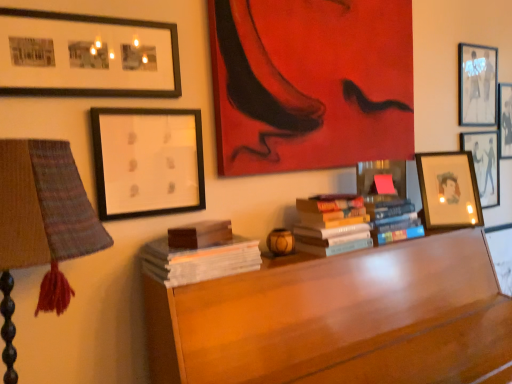
Measure the distance between point (x=343, y=65) and camera.

The distance of point (x=343, y=65) from camera is 5.27 feet.

Find the location of a particular element. matte brown book at center, acting as the third book starting from the right is located at coordinates [x=200, y=234].

This screenshot has height=384, width=512. In order to click on matte black picture frame at upper right, which appears as the fifth picture frame when viewed from the left in this screenshot , I will do `click(478, 85)`.

What do you see at coordinates (199, 254) in the screenshot?
I see `white paper book at left, which is the 4th book in right-to-left order` at bounding box center [199, 254].

What is the approximate width of matte wooden picture frame at right, which is the 4th picture frame from right to left?

11.02 inches.

Image resolution: width=512 pixels, height=384 pixels. I want to click on matte black framed photos at upper left, marked as the seventh picture frame in a right-to-left arrangement, so click(x=86, y=56).

Locate an element on the screen. The height and width of the screenshot is (384, 512). matte red painting at upper center, which is the 5th picture frame from right to left is located at coordinates (311, 83).

Does hardcover books at center, the second book in the right-to-left sequence, contain hardcover books at center, arranged as the fourth book when viewed from the left?

No, hardcover books at center, arranged as the fourth book when viewed from the left, is not inside hardcover books at center, the second book in the right-to-left sequence.

Is hardcover books at center, marked as the 3th book in a left-to-right arrangement, in contact with hardcover books at center, acting as the 1th book starting from the right?

No, hardcover books at center, marked as the 3th book in a left-to-right arrangement, is not in contact with hardcover books at center, acting as the 1th book starting from the right.

Find the location of `book behind the hardcover books at center, the second book in the right-to-left sequence`. book behind the hardcover books at center, the second book in the right-to-left sequence is located at coordinates (392, 219).

Looking at this image, considering the positions of objects hardcover books at center, the second book in the right-to-left sequence, and hardcover books at center, arranged as the fourth book when viewed from the left, in the image provided, who is more to the left, hardcover books at center, the second book in the right-to-left sequence, or hardcover books at center, arranged as the fourth book when viewed from the left,?

hardcover books at center, the second book in the right-to-left sequence, is more to the left.

Between matte wooden picture frame at right, the 4th picture frame when ordered from left to right, and wooden desk at center, which one has smaller width?

Thinner between the two is matte wooden picture frame at right, the 4th picture frame when ordered from left to right.

Is matte wooden picture frame at right, the 4th picture frame when ordered from left to right, bigger than wooden desk at center?

Actually, matte wooden picture frame at right, the 4th picture frame when ordered from left to right, might be smaller than wooden desk at center.

Which is correct: matte wooden picture frame at right, which is the 4th picture frame from right to left, is inside wooden desk at center, or outside of it?

matte wooden picture frame at right, which is the 4th picture frame from right to left, is outside wooden desk at center.

Considering the relative positions of hardcover books at center, marked as the 3th book in a left-to-right arrangement, and wooden desk at center in the image provided, is hardcover books at center, marked as the 3th book in a left-to-right arrangement, to the left or to the right of wooden desk at center?

From the image, it's evident that hardcover books at center, marked as the 3th book in a left-to-right arrangement, is to the left of wooden desk at center.

Is hardcover books at center, marked as the 3th book in a left-to-right arrangement, positioned in front of wooden desk at center?

No, hardcover books at center, marked as the 3th book in a left-to-right arrangement, is behind wooden desk at center.

Can you tell me how much hardcover books at center, the second book in the right-to-left sequence, and wooden desk at center differ in facing direction?

hardcover books at center, the second book in the right-to-left sequence, and wooden desk at center are facing 4 degrees away from each other.

The width and height of the screenshot is (512, 384). In the image, there is a hardcover books at center, the second book in the right-to-left sequence. Identify the location of furniture below it (from the image's perspective). (338, 319).

Does matte black picture frame at upper right, the third picture frame from the right, have a smaller size compared to white paper book at left, which is the 4th book in right-to-left order?

Incorrect, matte black picture frame at upper right, the third picture frame from the right, is not smaller in size than white paper book at left, which is the 4th book in right-to-left order.

Which point is more distant from viewer, (480, 115) or (197, 231)?

The point (480, 115) is behind.

Is matte black picture frame at upper right, which appears as the fifth picture frame when viewed from the left, spatially inside white paper book at left, which is the 4th book in right-to-left order, or outside of it?

matte black picture frame at upper right, which appears as the fifth picture frame when viewed from the left, is spatially situated outside white paper book at left, which is the 4th book in right-to-left order.

Is point (497, 55) positioned after point (360, 244)?

Yes.

Could hardcover books at center, marked as the 3th book in a left-to-right arrangement, be considered to be inside matte black picture frame at upper right, the third picture frame from the right?

No, hardcover books at center, marked as the 3th book in a left-to-right arrangement, is located outside of matte black picture frame at upper right, the third picture frame from the right.

From a real-world perspective, is matte black picture frame at upper right, the third picture frame from the right, above or below hardcover books at center, the second book in the right-to-left sequence?

From a real-world perspective, matte black picture frame at upper right, the third picture frame from the right, is physically above hardcover books at center, the second book in the right-to-left sequence.

Is matte black picture frame at upper right, which appears as the fifth picture frame when viewed from the left, facing towards hardcover books at center, the second book in the right-to-left sequence?

No, matte black picture frame at upper right, which appears as the fifth picture frame when viewed from the left, is not turned towards hardcover books at center, the second book in the right-to-left sequence.

Is white paper book at left, acting as the first book starting from the left, next to matte paper picture frame at right, which is counted as the sixth picture frame, starting from the left, and touching it?

No, white paper book at left, acting as the first book starting from the left, is not in contact with matte paper picture frame at right, which is counted as the sixth picture frame, starting from the left.

Is white paper book at left, acting as the first book starting from the left, situated inside matte paper picture frame at right, which is counted as the sixth picture frame, starting from the left, or outside?

white paper book at left, acting as the first book starting from the left, exists outside the volume of matte paper picture frame at right, which is counted as the sixth picture frame, starting from the left.

From the image's perspective, between white paper book at left, acting as the first book starting from the left, and matte paper picture frame at right, which is counted as the sixth picture frame, starting from the left, who is located below?

white paper book at left, acting as the first book starting from the left.

From a real-world perspective, is white paper book at left, which is the 4th book in right-to-left order, positioned above or below matte paper picture frame at right, arranged as the second picture frame when viewed from the right?

white paper book at left, which is the 4th book in right-to-left order, is situated lower than matte paper picture frame at right, arranged as the second picture frame when viewed from the right, in the real world.

Looking at this image, from a real-world perspective, between white paper at upper left, which ranks as the 2th picture frame in left-to-right order, and matte red painting at upper center, acting as the third picture frame starting from the left, who is vertically lower?

white paper at upper left, which ranks as the 2th picture frame in left-to-right order, from a real-world perspective.

Between white paper at upper left, which ranks as the 2th picture frame in left-to-right order, and matte red painting at upper center, acting as the third picture frame starting from the left, which one has less height?

Standing shorter between the two is white paper at upper left, which ranks as the 2th picture frame in left-to-right order.

Is white paper at upper left, the sixth picture frame positioned from the right, smaller than matte red painting at upper center, acting as the third picture frame starting from the left?

Yes, white paper at upper left, the sixth picture frame positioned from the right, is smaller than matte red painting at upper center, acting as the third picture frame starting from the left.

Is white paper at upper left, which ranks as the 2th picture frame in left-to-right order, directly adjacent to matte red painting at upper center, which is the 5th picture frame from right to left?

No, white paper at upper left, which ranks as the 2th picture frame in left-to-right order, is not in contact with matte red painting at upper center, which is the 5th picture frame from right to left.

From a real-world perspective, starting from the hardcover books at center, marked as the 3th book in a left-to-right arrangement, which book is the 1st one below it? Please provide its 2D coordinates.

[(392, 219)]

Where is `furniture that appears below the matte wooden picture frame at right, which is the 4th picture frame from right to left (from the image's perspective)`? The image size is (512, 384). furniture that appears below the matte wooden picture frame at right, which is the 4th picture frame from right to left (from the image's perspective) is located at coordinates (338, 319).

Which object lies further to the anchor point wooden desk at center, matte paper picture frame at right, arranged as the second picture frame when viewed from the right, or matte black framed photos at upper left, which appears as the first picture frame when viewed from the left?

matte black framed photos at upper left, which appears as the first picture frame when viewed from the left, is positioned further to the anchor wooden desk at center.

Consider the image. Estimate the real-world distances between objects in this image. Which object is further from white paper at upper left, which ranks as the 2th picture frame in left-to-right order, matte paper picture frame at right, arranged as the second picture frame when viewed from the right, or matte black framed photos at upper left, which appears as the first picture frame when viewed from the left?

Based on the image, matte paper picture frame at right, arranged as the second picture frame when viewed from the right, appears to be further to white paper at upper left, which ranks as the 2th picture frame in left-to-right order.

From the image, which object appears to be nearer to matte red painting at upper center, which is the 5th picture frame from right to left, matte wooden picture frame at right, which is the 4th picture frame from right to left, or matte black framed photos at upper left, marked as the seventh picture frame in a right-to-left arrangement?

Based on the image, matte wooden picture frame at right, which is the 4th picture frame from right to left, appears to be nearer to matte red painting at upper center, which is the 5th picture frame from right to left.

Based on their spatial positions, is matte black picture frame at upper right, the first picture frame positioned from the right, or matte black framed photos at upper left, marked as the seventh picture frame in a right-to-left arrangement, closer to white paper at upper left, the sixth picture frame positioned from the right?

The object closer to white paper at upper left, the sixth picture frame positioned from the right, is matte black framed photos at upper left, marked as the seventh picture frame in a right-to-left arrangement.

When comparing their distances from white paper book at left, which is the 4th book in right-to-left order, does matte wooden picture frame at right, the 4th picture frame when ordered from left to right, or matte black picture frame at upper right, which appears as the fifth picture frame when viewed from the left, seem further?

matte black picture frame at upper right, which appears as the fifth picture frame when viewed from the left, is further to white paper book at left, which is the 4th book in right-to-left order.

Looking at the image, which one is located closer to matte black picture frame at upper right, the seventh picture frame from the left, matte wooden picture frame at right, the 4th picture frame when ordered from left to right, or wooden desk at center?

matte wooden picture frame at right, the 4th picture frame when ordered from left to right.

From the image, which object appears to be nearer to matte black picture frame at upper right, the first picture frame positioned from the right, white paper at upper left, the sixth picture frame positioned from the right, or white paper book at left, which is the 4th book in right-to-left order?

The object closer to matte black picture frame at upper right, the first picture frame positioned from the right, is white paper book at left, which is the 4th book in right-to-left order.

Estimate the real-world distances between objects in this image. Which object is closer to matte red painting at upper center, acting as the third picture frame starting from the left, matte brown book at center, acting as the third book starting from the right, or matte black picture frame at upper right, the seventh picture frame from the left?

matte brown book at center, acting as the third book starting from the right, is positioned closer to the anchor matte red painting at upper center, acting as the third picture frame starting from the left.

The height and width of the screenshot is (384, 512). Identify the location of furniture situated between matte black framed photos at upper left, marked as the seventh picture frame in a right-to-left arrangement, and matte paper picture frame at right, which is counted as the sixth picture frame, starting from the left, from left to right. (338, 319).

Image resolution: width=512 pixels, height=384 pixels. I want to click on picture frame between white paper book at left, acting as the first book starting from the left, and matte wooden picture frame at right, which is the 4th picture frame from right to left, from left to right, so click(x=311, y=83).

Where is `furniture between white paper at upper left, which ranks as the 2th picture frame in left-to-right order, and matte paper picture frame at right, arranged as the second picture frame when viewed from the right, from left to right`? The image size is (512, 384). furniture between white paper at upper left, which ranks as the 2th picture frame in left-to-right order, and matte paper picture frame at right, arranged as the second picture frame when viewed from the right, from left to right is located at coordinates (338, 319).

This screenshot has height=384, width=512. Find the location of `furniture between matte brown book at center, acting as the third book starting from the right, and matte paper picture frame at right, which is counted as the sixth picture frame, starting from the left`. furniture between matte brown book at center, acting as the third book starting from the right, and matte paper picture frame at right, which is counted as the sixth picture frame, starting from the left is located at coordinates (338, 319).